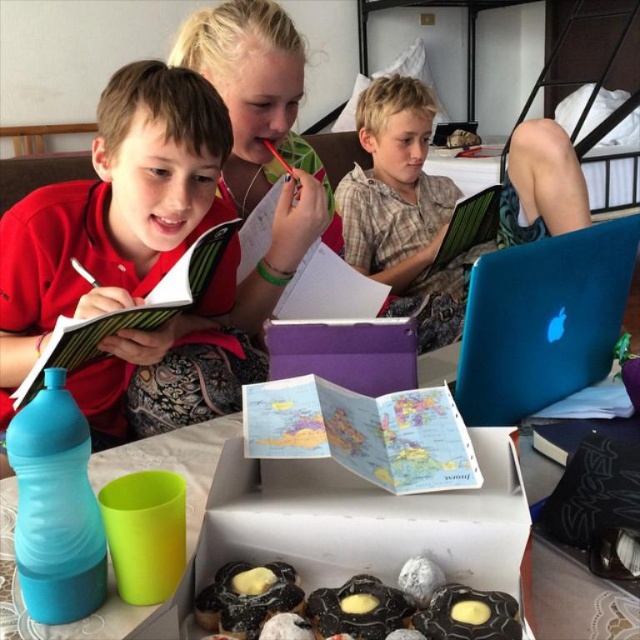
Based on the coordinates provided, where exactly is the chocolate glazed pastry at lower center located?

The chocolate glazed pastry at lower center is located at point 0.934 on the x axis and 0.388 on the y axis.

You are standing in front of the table where the children are working. There are two points marked on the table. One is at coordinate point (74, 380) and the other is at point (227, 435). Which point is closer to you?

Point (74, 380) is closer to you because it is further to the viewer than point (227, 435).

You are a teacher observing the children at the table. You notice two points marked on the table surface. The first point is at coordinate point (243, 628) and the second is at point (472, 227). From the perspective of the child sitting at the table, which point is closer to them?

Point (243, 628) is in front of point (472, 227), so from the child sitting at the table, point (243, 628) is closer to them.